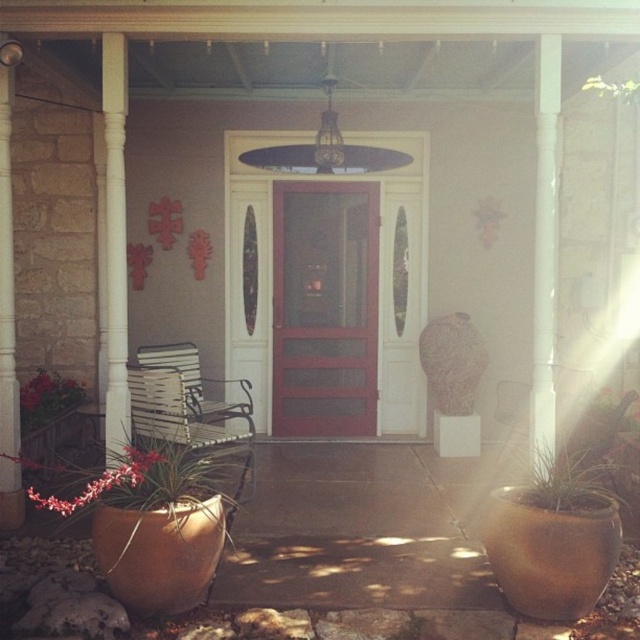
Can you confirm if green matte plant at lower right is taller than green leafy plant at lower left?

Correct, green matte plant at lower right is much taller as green leafy plant at lower left.

Identify the location of green matte plant at lower right. The width and height of the screenshot is (640, 640). (573, 480).

Can you confirm if white painted wood column at left is positioned above green matte plant at lower right?

Yes.

Can you confirm if white painted wood column at left is wider than green matte plant at lower right?

Incorrect, white painted wood column at left's width does not surpass green matte plant at lower right's.

Who is more distant from viewer, (6, 368) or (525, 492)?

The point (6, 368) is behind.

What are the coordinates of `white painted wood column at left` in the screenshot? It's located at [x=6, y=278].

Looking at this image, can you confirm if matte terracotta pot at lower left is smaller than white painted wood column at left?

No.

Can you confirm if matte terracotta pot at lower left is positioned to the right of white painted wood column at left?

Indeed, matte terracotta pot at lower left is positioned on the right side of white painted wood column at left.

Who is more forward, (209, 490) or (13, 324)?

Point (209, 490)

Find the location of a particular element. matte terracotta pot at lower left is located at coordinates (125, 476).